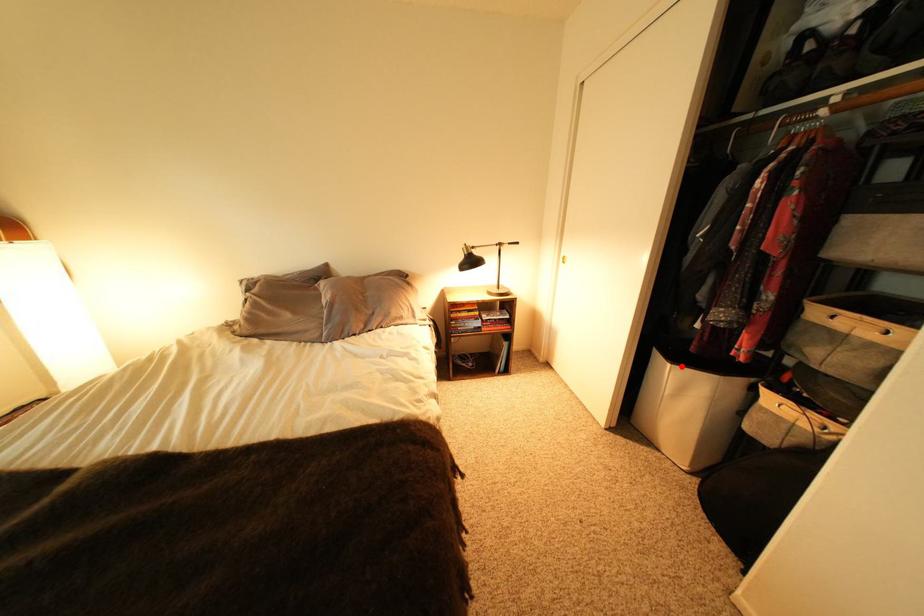
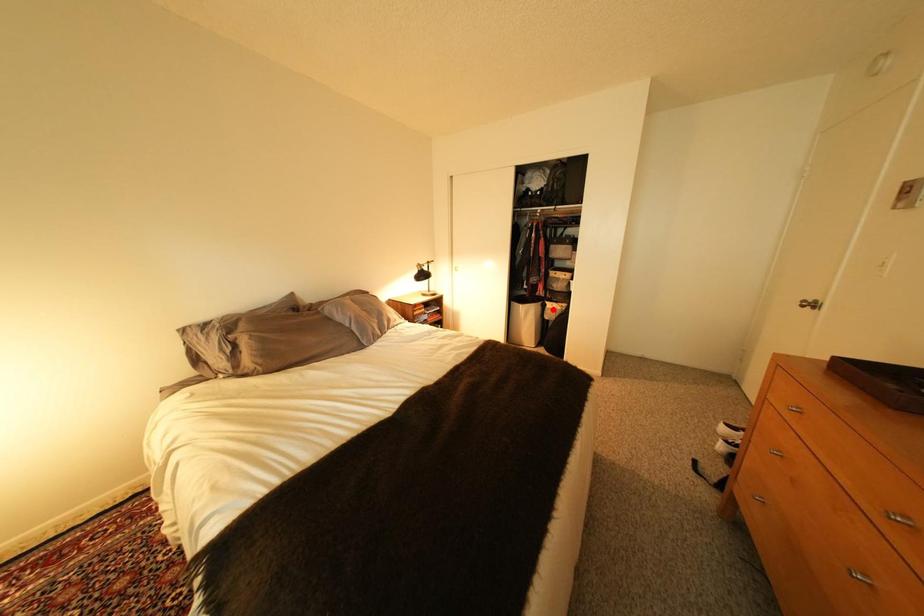
I am providing you with two images of the same scene from different viewpoints. A red point is marked on the first image and another point is marked on the second image. Does the point marked in image1 correspond to the same location as the one in image2?

No